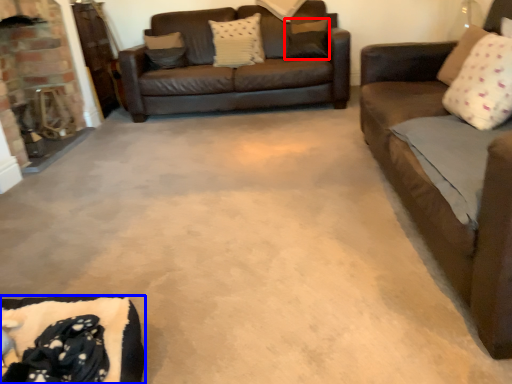
Question: Which object appears farthest to the camera in this image, pillow (highlighted by a red box) or couch (highlighted by a blue box)?

Choices:
 (A) pillow
 (B) couch

Answer: (A)